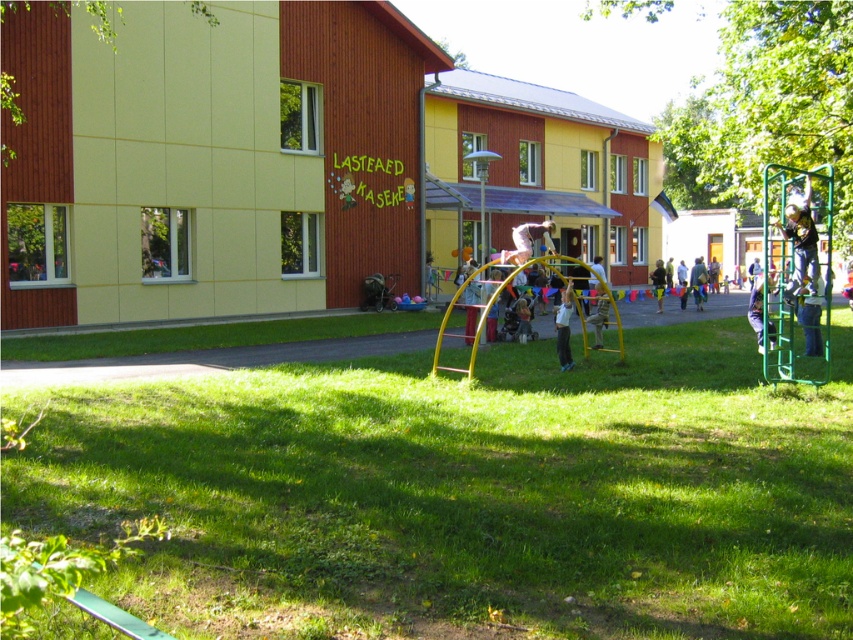
Does blue fabric pants at center lie in front of green fabric swing at center?

Yes, it is.

Who is more distant from viewer, (773, 348) or (686, 300)?

Point (686, 300)

At what (x,y) coordinates should I click in order to perform the action: click on blue fabric pants at center. Please return your answer as a coordinate pair (x, y). Looking at the image, I should click on (756, 310).

Is blue fabric pants at center wider than light blue jeans at center?

In fact, blue fabric pants at center might be narrower than light blue jeans at center.

Does blue fabric pants at center appear over light blue jeans at center?

No, blue fabric pants at center is not above light blue jeans at center.

Does point (766, 288) lie in front of point (711, 276)?

Yes, it is in front of point (711, 276).

Locate an element on the screen. The image size is (853, 640). blue fabric pants at center is located at coordinates (756, 310).

Does yellow rubber playground equipment at center lie in front of green fabric swing at center?

Yes.

Can you confirm if yellow rubber playground equipment at center is positioned to the left of green fabric swing at center?

Yes, yellow rubber playground equipment at center is to the left of green fabric swing at center.

I want to click on yellow rubber playground equipment at center, so click(x=468, y=493).